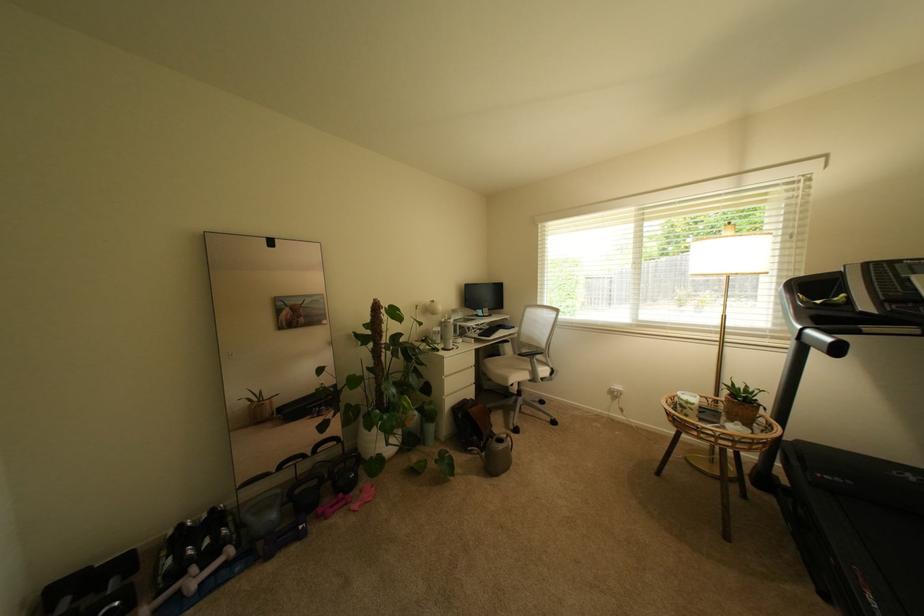
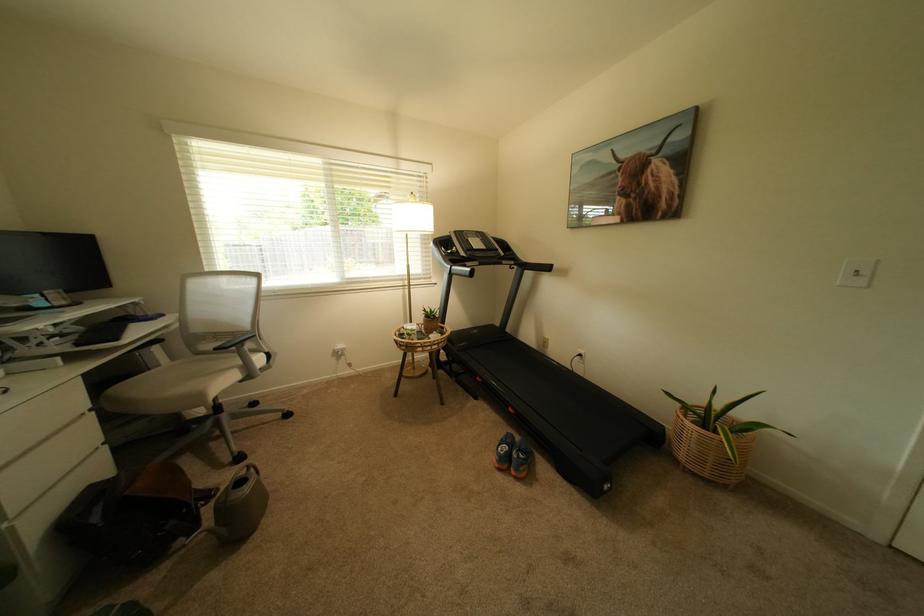
Question: The images are taken continuously from a first-person perspective. In which direction is your viewpoint rotating?

Choices:
 (A) Left
 (B) Right
 (C) Up
 (D) Down

Answer: (B)